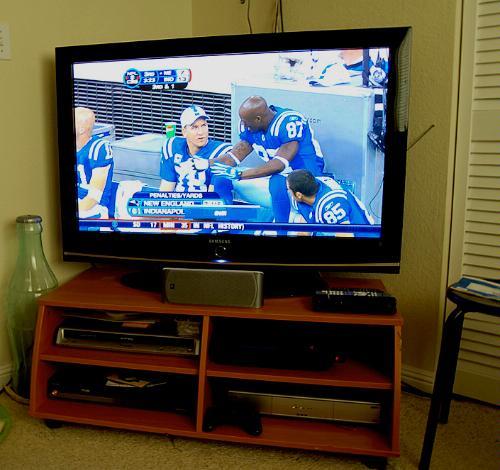
Locate an element on the screen. tv stand is located at coordinates (205, 314).